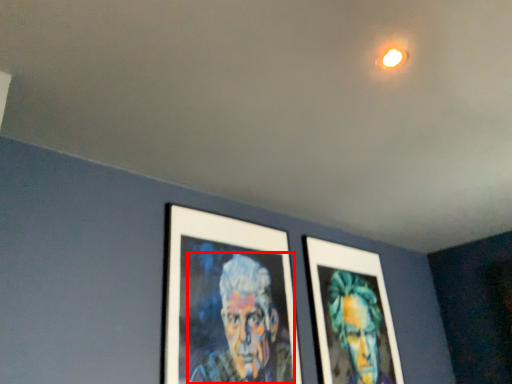
Question: In this image, where is person (annotated by the red box) located relative to person?

Choices:
 (A) right
 (B) left

Answer: (B)